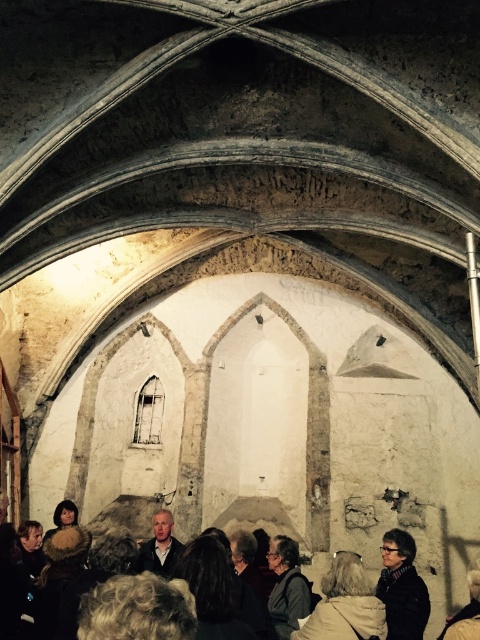
Does dark brown leather jacket at lower center have a larger size compared to dark gray fabric jacket at center?

Yes.

Can you confirm if dark brown leather jacket at lower center is thinner than dark gray fabric jacket at center?

In fact, dark brown leather jacket at lower center might be wider than dark gray fabric jacket at center.

At what (x,y) coordinates should I click in order to perform the action: click on dark brown leather jacket at lower center. Please return your answer as a coordinate pair (x, y). Looking at the image, I should click on (384, 524).

This screenshot has width=480, height=640. In order to click on dark brown leather jacket at lower center in this screenshot , I will do `click(384, 524)`.

Between dark brown leather jacket at lower center and matte black jacket at lower right, which one has more height?

Standing taller between the two is dark brown leather jacket at lower center.

Can you confirm if dark brown leather jacket at lower center is wider than matte black jacket at lower right?

Yes, dark brown leather jacket at lower center is wider than matte black jacket at lower right.

The image size is (480, 640). What are the coordinates of `dark brown leather jacket at lower center` in the screenshot? It's located at (384, 524).

Does matte black jacket at lower right appear under dark gray fabric jacket at center?

Yes.

Which is in front, point (389, 593) or point (144, 557)?

Point (389, 593)

This screenshot has height=640, width=480. What do you see at coordinates (402, 588) in the screenshot?
I see `matte black jacket at lower right` at bounding box center [402, 588].

This screenshot has width=480, height=640. I want to click on matte black jacket at lower right, so click(x=402, y=588).